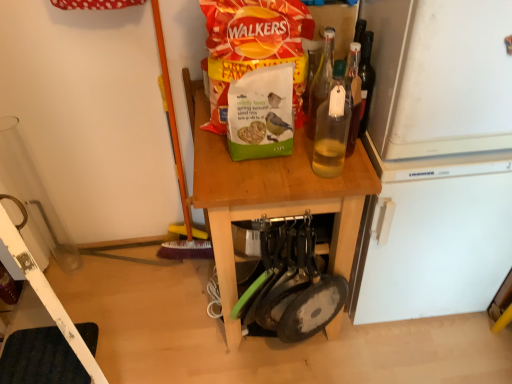
Locate an element on the screen. Image resolution: width=512 pixels, height=384 pixels. vacant area in front of white matte refrigerator at right is located at coordinates click(423, 360).